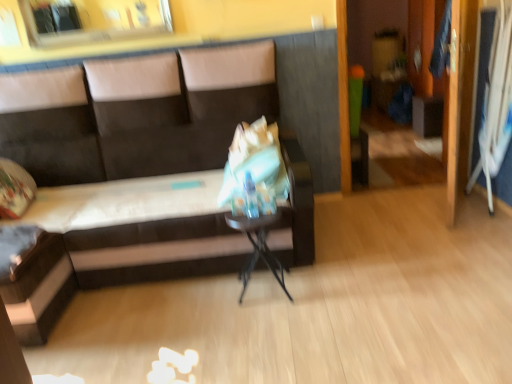
Question: Could dark brown leather couch at center be considered to be inside metallic silver table at center?

Choices:
 (A) no
 (B) yes

Answer: (A)

Question: Does metallic silver table at center have a lesser width compared to dark brown leather couch at center?

Choices:
 (A) yes
 (B) no

Answer: (A)

Question: From a real-world perspective, is metallic silver table at center physically above dark brown leather couch at center?

Choices:
 (A) yes
 (B) no

Answer: (B)

Question: Is metallic silver table at center wider than dark brown leather couch at center?

Choices:
 (A) no
 (B) yes

Answer: (A)

Question: Does metallic silver table at center lie in front of dark brown leather couch at center?

Choices:
 (A) yes
 (B) no

Answer: (B)

Question: From a real-world perspective, is metallic silver table at center beneath dark brown leather couch at center?

Choices:
 (A) no
 (B) yes

Answer: (B)

Question: Considering the relative sizes of dark brown leather couch at center and metallic silver table at center in the image provided, is dark brown leather couch at center bigger than metallic silver table at center?

Choices:
 (A) yes
 (B) no

Answer: (A)

Question: Is dark brown leather couch at center facing towards metallic silver table at center?

Choices:
 (A) yes
 (B) no

Answer: (A)

Question: Is dark brown leather couch at center in contact with metallic silver table at center?

Choices:
 (A) yes
 (B) no

Answer: (B)

Question: From the image's perspective, is dark brown leather couch at center under metallic silver table at center?

Choices:
 (A) yes
 (B) no

Answer: (B)

Question: Can you confirm if dark brown leather couch at center is wider than metallic silver table at center?

Choices:
 (A) yes
 (B) no

Answer: (A)

Question: Is dark brown leather couch at center outside metallic silver table at center?

Choices:
 (A) yes
 (B) no

Answer: (A)

Question: From a real-world perspective, is metallic silver table at center physically located above or below dark brown leather couch at center?

Choices:
 (A) below
 (B) above

Answer: (A)